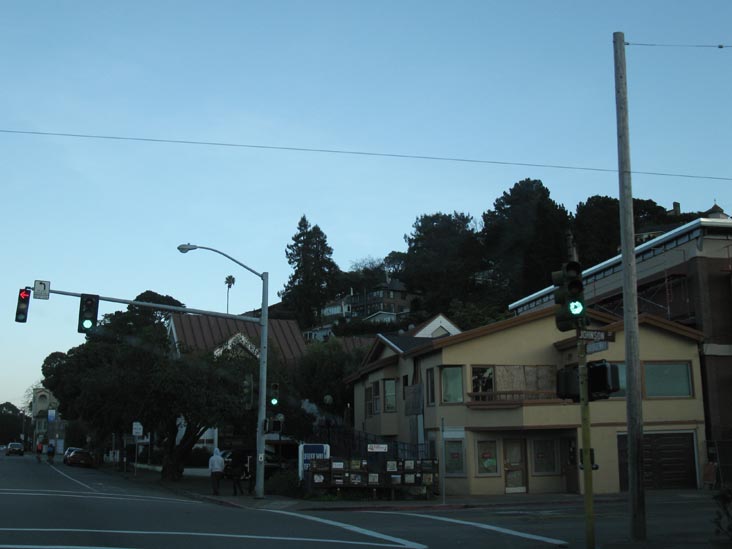
Where is `green light`? green light is located at coordinates (577, 306), (86, 324).